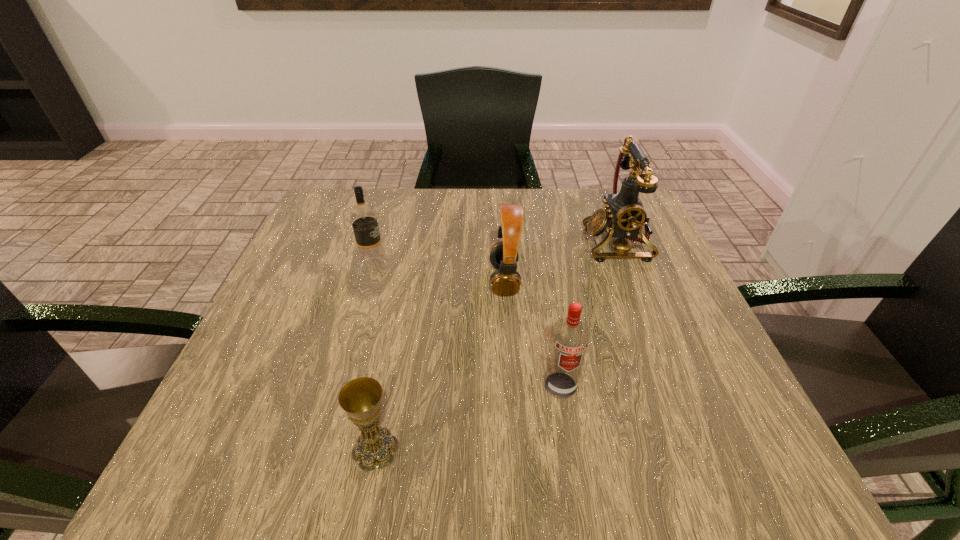
You are a GUI agent. You are given a task and a screenshot of the screen. Output one action in this format:
    pyautogui.click(x=<x>, y=<y>)
    Task: Click on the telephone
    The width and height of the screenshot is (960, 540).
    Given the screenshot: What is the action you would take?
    click(624, 216)

At what (x,y) coordinates should I click in order to perform the action: click on the rightmost object. Please return your answer as a coordinate pair (x, y). The height and width of the screenshot is (540, 960). Looking at the image, I should click on [x=624, y=216].

Where is `the farther vodka`? The width and height of the screenshot is (960, 540). the farther vodka is located at coordinates (364, 221).

Locate an element on the screen. the leftmost object is located at coordinates (364, 221).

Identify the location of the right vodka. This screenshot has width=960, height=540. (569, 339).

This screenshot has width=960, height=540. Identify the location of the nearer vodka. pyautogui.click(x=569, y=339).

You are a GUI agent. You are given a task and a screenshot of the screen. Output one action in this format:
    pyautogui.click(x=<x>, y=<y>)
    Task: Click on the headset
    This screenshot has height=540, width=960.
    Given the screenshot: What is the action you would take?
    pyautogui.click(x=506, y=281)

Find the location of `the fourth object from right to left`. the fourth object from right to left is located at coordinates (360, 398).

Where is `the shortest object`? the shortest object is located at coordinates (360, 398).

The image size is (960, 540). What are the coordinates of `vacant space located 0.100m on the front of the telephone, featuring the rotary dial` in the screenshot? It's located at (541, 242).